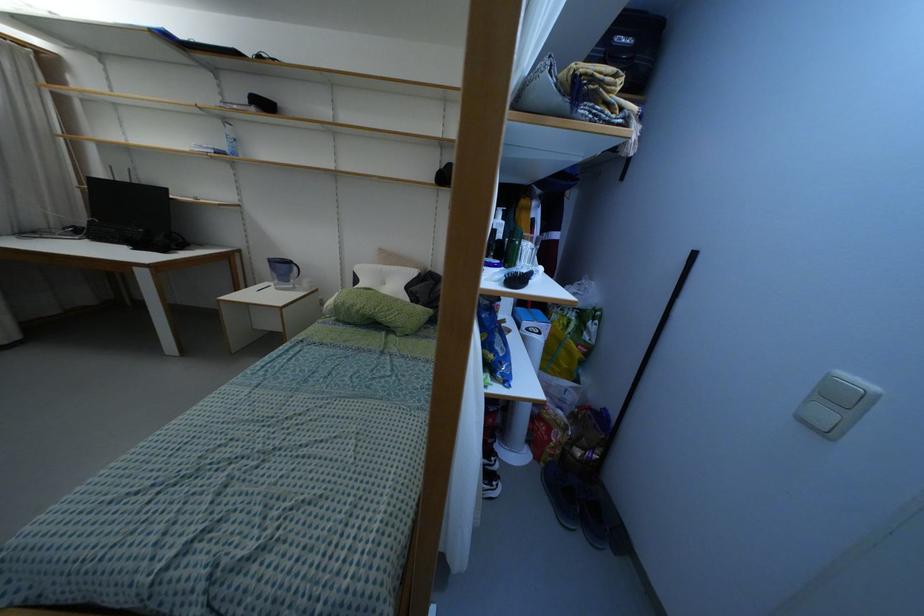
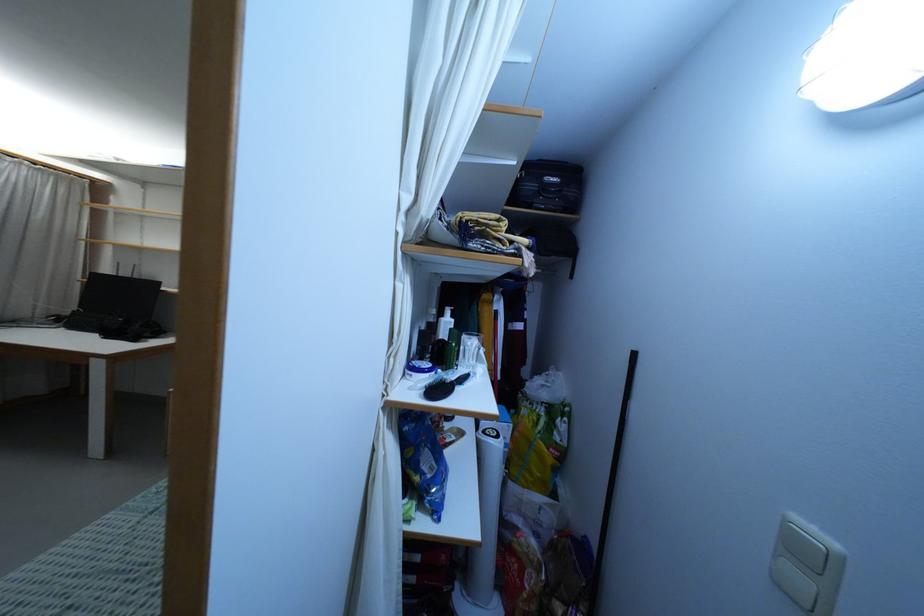
In the second image, find the point that corresponds to point 824,414 in the first image.

(799, 580)